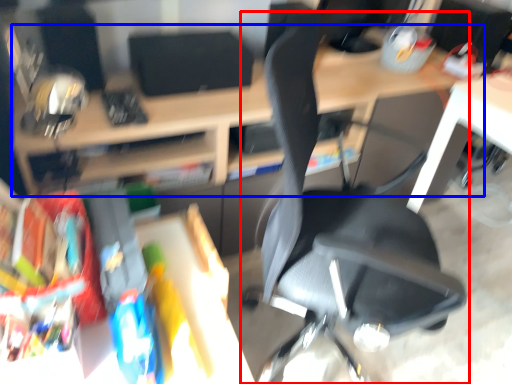
Question: Which point is closer to the camera, chair (highlighted by a red box) or desk (highlighted by a blue box)?

Choices:
 (A) chair
 (B) desk

Answer: (A)